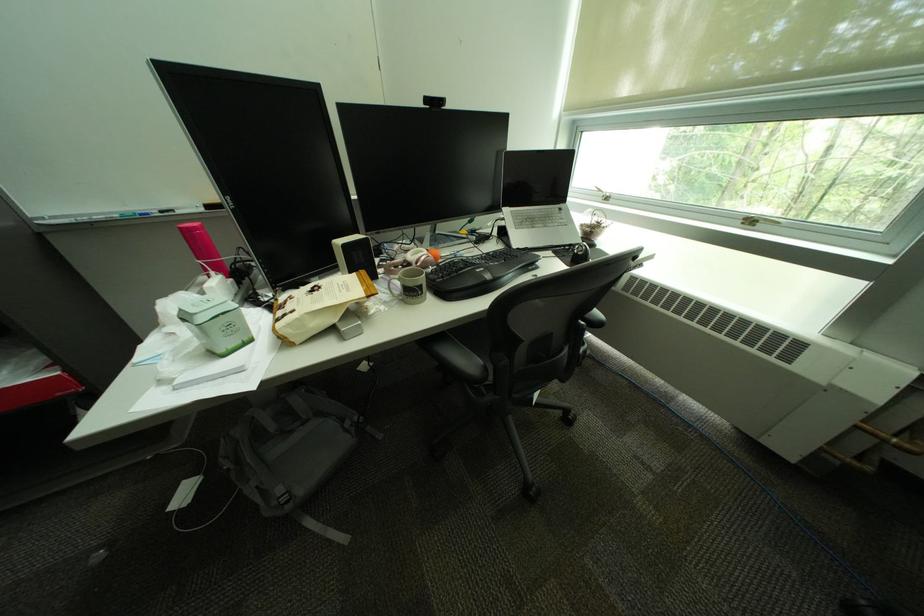
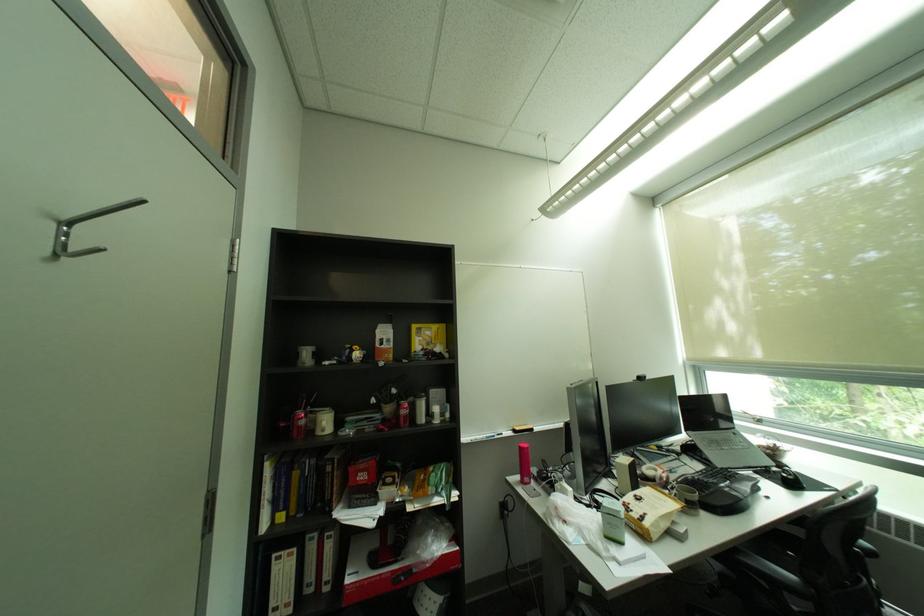
Locate, in the second image, the point that corresponds to pixel 580 246 in the first image.

(777, 468)